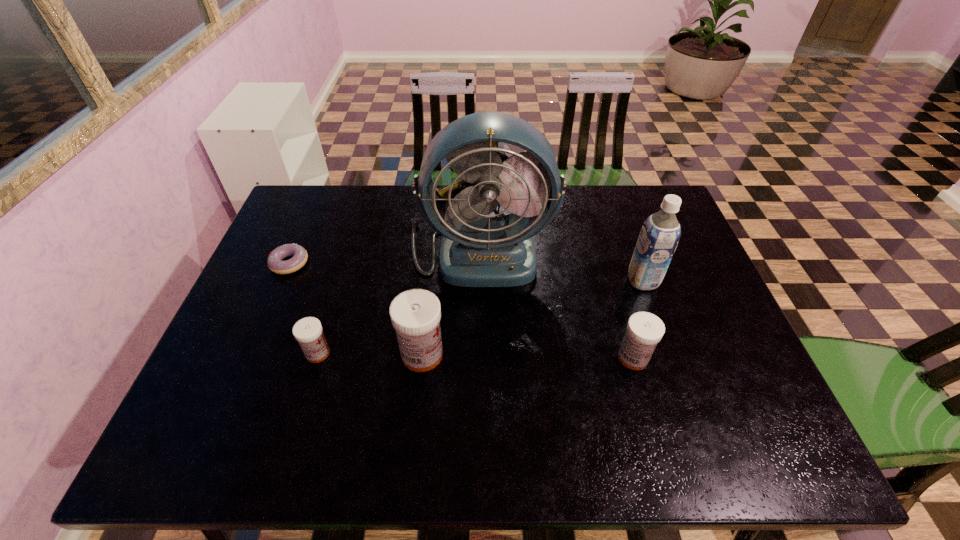
To achieve even spacing by inserting another medicine among them, please point to a vacant spot for this new medicine. Please provide its 2D coordinates. Your answer should be formatted as a tuple, i.e. [(x, y)], where the tuple contains the x and y coordinates of a point satisfying the conditions above.

[(527, 356)]